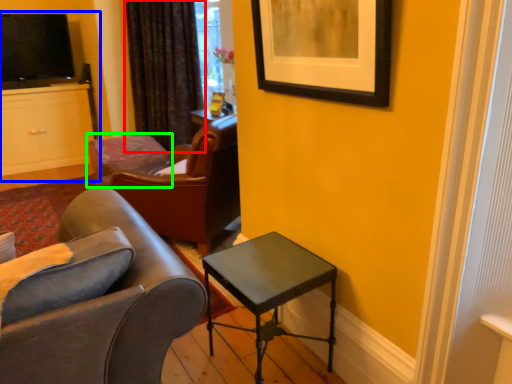
Question: Which is nearer to the curtain (highlighted by a red box)? entertainment center (highlighted by a blue box) or chair (highlighted by a green box).

Choices:
 (A) entertainment center
 (B) chair

Answer: (B)